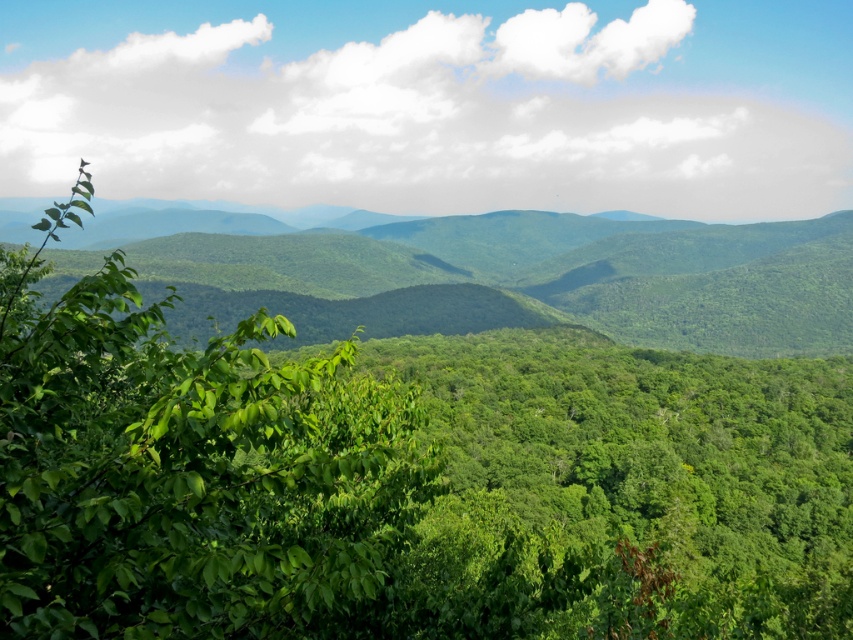
You are standing at the center of the image and want to locate the green leafy tree at left. Based on its coordinates, in which direction should you look to find it?

The green leafy tree at left is located at point 0.731 on the x and 0.218 on the y. Since the x coordinate is greater than 0.5, it is to the right of the center. However, the description mentions it is at the left, so there might be a discrepancy. Assuming the coordinate system places (0,0) at the bottom left, higher x goes right and higher y goes up. If the tree is at left, perhaps the x is lower. Wait, the given coordinates are x 0.731 which is more than 0.5, meaning right half. But the object label says it

Consider the image. You are standing at the point marked as point (184, 467) in the image. What object is located exactly at this point?

The green leafy tree at left is located exactly at point (184, 467).

You are standing at the point with coordinates point [202,292] and want to take a photo of the mountain landscape. If you move towards point [120,422], will your view of the mountain become more obstructed or less obstructed?

Moving towards point [120,422] will make your view of the mountain less obstructed because point [120,422] is closer to the camera than point [202,292], meaning it is in a position with less foreground obstruction.